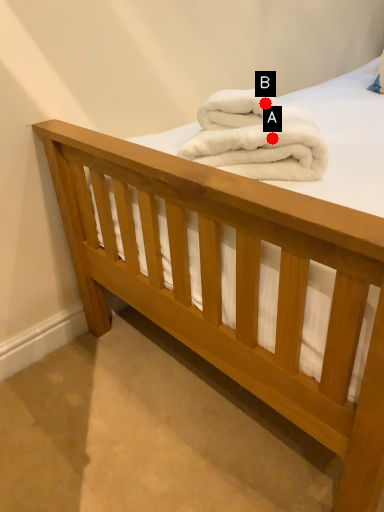
Question: Two points are circled on the image, labeled by A and B beside each circle. Which point is closer to the camera?

Choices:
 (A) A is closer
 (B) B is closer

Answer: (A)